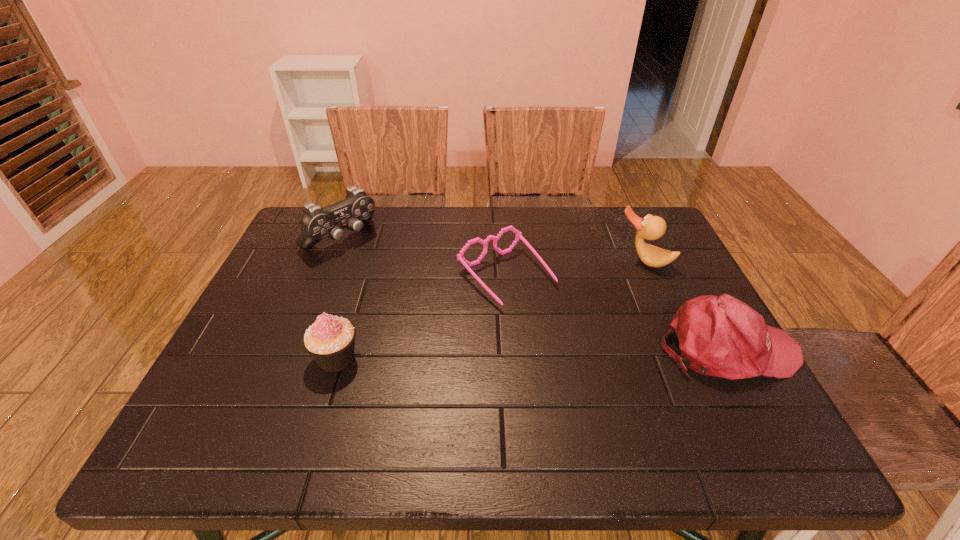
Locate an element on the screen. This screenshot has height=540, width=960. baseball cap at the near edge is located at coordinates (721, 336).

Where is `object that is at the left edge`? This screenshot has height=540, width=960. object that is at the left edge is located at coordinates (357, 208).

Find the location of `baseball cap that is at the right edge`. baseball cap that is at the right edge is located at coordinates (721, 336).

Identify the location of duck that is at the right edge. The height and width of the screenshot is (540, 960). (651, 227).

Where is `object that is at the far left corner`? The height and width of the screenshot is (540, 960). object that is at the far left corner is located at coordinates (357, 208).

Find the location of a particular element. The height and width of the screenshot is (540, 960). object at the far right corner is located at coordinates 651,227.

The width and height of the screenshot is (960, 540). I want to click on object that is positioned at the near right corner, so click(x=721, y=336).

Find the location of a particular element. The width and height of the screenshot is (960, 540). free space at the far edge of the desktop is located at coordinates (510, 241).

The height and width of the screenshot is (540, 960). What are the coordinates of `free space at the near edge` in the screenshot? It's located at (427, 382).

In the image, there is a desktop. Identify the location of vacant space at the left edge. (293, 315).